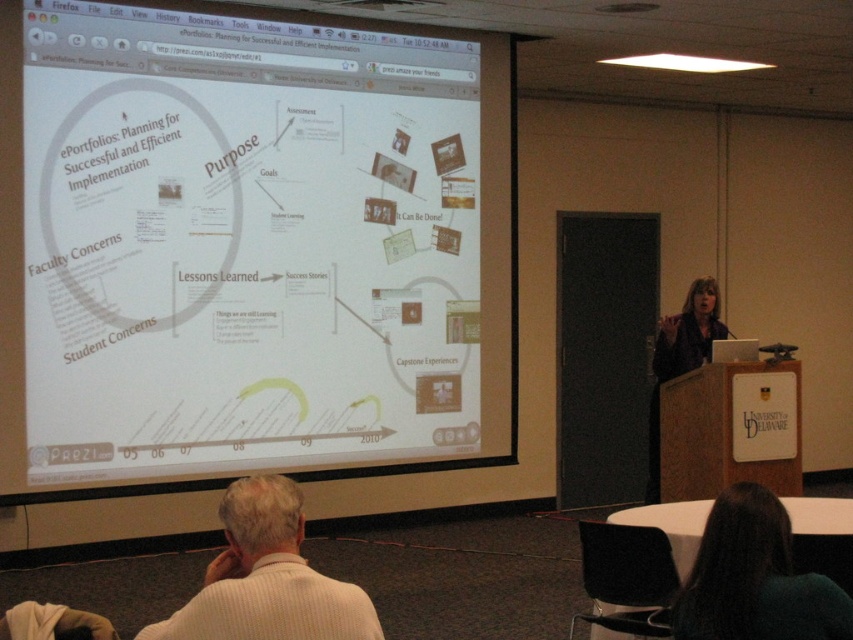
Question: Which object appears closest to the camera in this image?

Choices:
 (A) white paper at upper left
 (B) white textured sweater at lower left
 (C) dark brown hair at lower right
 (D) matte black shirt at center

Answer: (B)

Question: Does white paper at upper left have a greater width compared to dark brown hair at lower right?

Choices:
 (A) yes
 (B) no

Answer: (A)

Question: Where is white paper at upper left located in relation to white textured sweater at lower left in the image?

Choices:
 (A) below
 (B) above

Answer: (B)

Question: Observing the image, what is the correct spatial positioning of white paper at upper left in reference to matte black shirt at center?

Choices:
 (A) left
 (B) right

Answer: (A)

Question: Which point is closer to the camera?

Choices:
 (A) (677, 339)
 (B) (758, 577)
 (C) (231, 490)
 (D) (263, 112)

Answer: (C)

Question: Which of the following is the closest to the observer?

Choices:
 (A) white paper at upper left
 (B) white textured sweater at lower left
 (C) matte black shirt at center

Answer: (B)